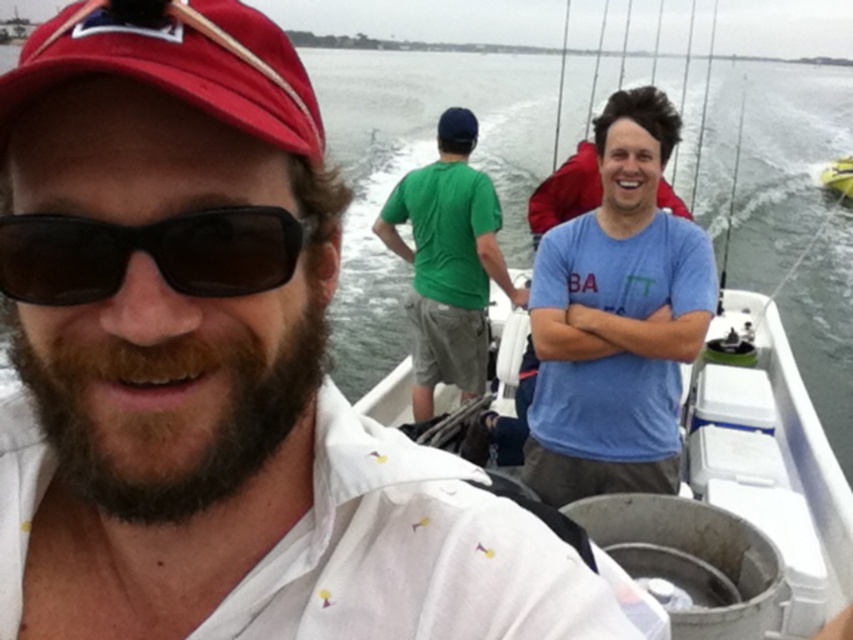
Which is in front, point (614, 412) or point (32, 81)?

Point (32, 81)

Can you confirm if blue cotton t-shirt at center is smaller than red fabric cap at upper left?

Incorrect, blue cotton t-shirt at center is not smaller in size than red fabric cap at upper left.

Which is behind, point (567, 225) or point (194, 96)?

The point (567, 225) is behind.

The image size is (853, 640). What are the coordinates of `blue cotton t-shirt at center` in the screenshot? It's located at (616, 320).

Which is in front, point (1, 80) or point (672, 204)?

Point (1, 80) is in front.

Can you confirm if red fabric cap at upper left is positioned to the left of blue cotton shirt at upper right?

Indeed, red fabric cap at upper left is positioned on the left side of blue cotton shirt at upper right.

This screenshot has width=853, height=640. What are the coordinates of `red fabric cap at upper left` in the screenshot? It's located at (178, 67).

Find the location of a particular element. Image resolution: width=853 pixels, height=640 pixels. red fabric cap at upper left is located at coordinates pos(178,67).

Between black plastic sunglasses at left and blue cotton shirt at upper right, which one has more height?

With more height is blue cotton shirt at upper right.

Looking at this image, does black plastic sunglasses at left have a lesser height compared to blue cotton shirt at upper right?

Yes.

Is point (100, 246) less distant than point (584, 195)?

Yes, it is.

In order to click on black plastic sunglasses at left in this screenshot , I will do `click(149, 253)`.